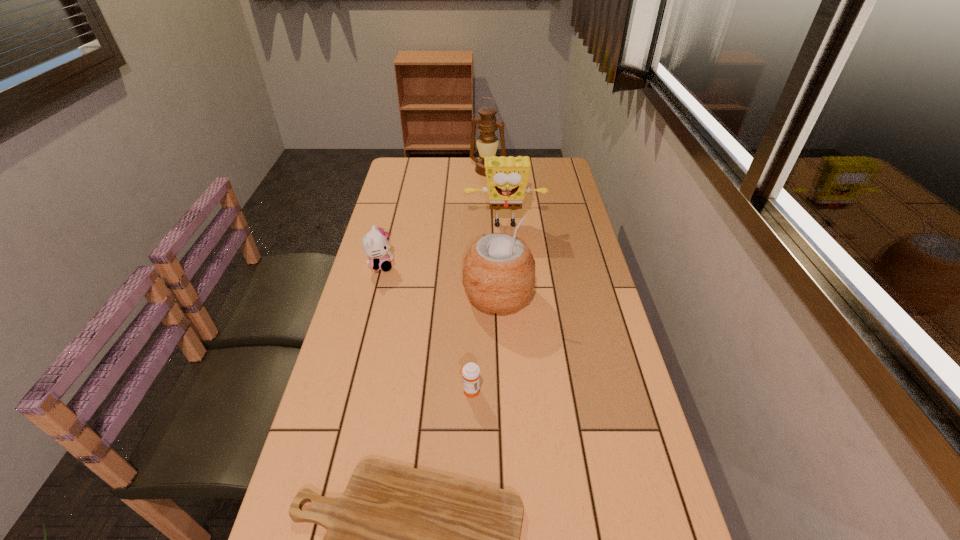
At what (x,y) coordinates should I click in order to perform the action: click on oil lamp. Please return your answer as a coordinate pair (x, y). The width and height of the screenshot is (960, 540). Looking at the image, I should click on (x=487, y=142).

Where is `the farthest object`? Image resolution: width=960 pixels, height=540 pixels. the farthest object is located at coordinates (487, 142).

Locate an element on the screen. The height and width of the screenshot is (540, 960). coconut is located at coordinates (499, 270).

In order to click on the fifth nearest object in this screenshot , I will do `click(507, 177)`.

The height and width of the screenshot is (540, 960). Find the location of `the fourth tallest object`. the fourth tallest object is located at coordinates [x=375, y=244].

Where is `the second nearest object`? The height and width of the screenshot is (540, 960). the second nearest object is located at coordinates (471, 372).

Locate an element on the screen. This screenshot has height=540, width=960. the second shortest object is located at coordinates (471, 372).

Locate an element on the screen. This screenshot has height=540, width=960. vacant space located 0.080m on the left of the farthest object is located at coordinates (451, 170).

Locate an element on the screen. This screenshot has height=540, width=960. free space located on the right of the coconut is located at coordinates (603, 295).

Identify the location of free spot located 0.150m on the front-facing side of the sponge. (508, 262).